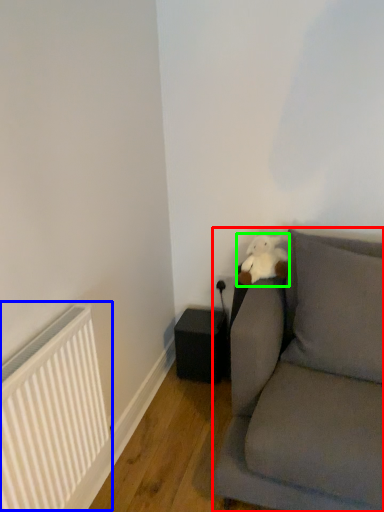
Question: Considering the real-world distances, which object is farthest from studio couch (highlighted by a red box)? radiator (highlighted by a blue box) or teddy (highlighted by a green box)?

Choices:
 (A) radiator
 (B) teddy

Answer: (A)